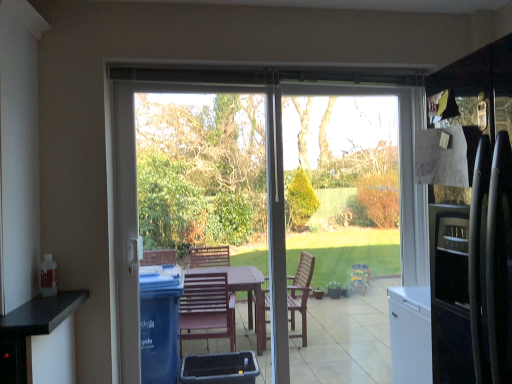
Question: From the image's perspective, is transparent glass door at center located above transparent glass window screen at center?

Choices:
 (A) yes
 (B) no

Answer: (B)

Question: Considering the relative sizes of transparent glass door at center and transparent glass window screen at center in the image provided, is transparent glass door at center thinner than transparent glass window screen at center?

Choices:
 (A) no
 (B) yes

Answer: (A)

Question: From the image's perspective, does transparent glass door at center appear lower than transparent glass window screen at center?

Choices:
 (A) yes
 (B) no

Answer: (A)

Question: From a real-world perspective, is transparent glass door at center located higher than transparent glass window screen at center?

Choices:
 (A) yes
 (B) no

Answer: (B)

Question: Is the position of transparent glass door at center more distant than that of transparent glass window screen at center?

Choices:
 (A) no
 (B) yes

Answer: (A)

Question: Is transparent glass window screen at center wider or thinner than transparent glass door at center?

Choices:
 (A) wide
 (B) thin

Answer: (B)

Question: From the image's perspective, is transparent glass window screen at center positioned above or below transparent glass door at center?

Choices:
 (A) above
 (B) below

Answer: (A)

Question: Looking at the image, does transparent glass window screen at center seem bigger or smaller compared to transparent glass door at center?

Choices:
 (A) big
 (B) small

Answer: (B)

Question: In the image, is transparent glass window screen at center positioned in front of or behind transparent glass door at center?

Choices:
 (A) front
 (B) behind

Answer: (B)

Question: Considering the relative positions of transparent glass window screen at center and transparent plastic screen door at center in the image provided, is transparent glass window screen at center to the left or to the right of transparent plastic screen door at center?

Choices:
 (A) right
 (B) left

Answer: (A)

Question: Is transparent glass window screen at center taller or shorter than transparent plastic screen door at center?

Choices:
 (A) short
 (B) tall

Answer: (B)

Question: Is transparent glass window screen at center inside or outside of transparent plastic screen door at center?

Choices:
 (A) outside
 (B) inside

Answer: (A)

Question: Is point (387, 236) closer or farther from the camera than point (170, 100)?

Choices:
 (A) farther
 (B) closer

Answer: (A)

Question: Is transparent glass door at center situated inside transparent glass window screen at center or outside?

Choices:
 (A) outside
 (B) inside

Answer: (B)

Question: From the image's perspective, is transparent glass door at center above or below transparent glass window screen at center?

Choices:
 (A) below
 (B) above

Answer: (A)